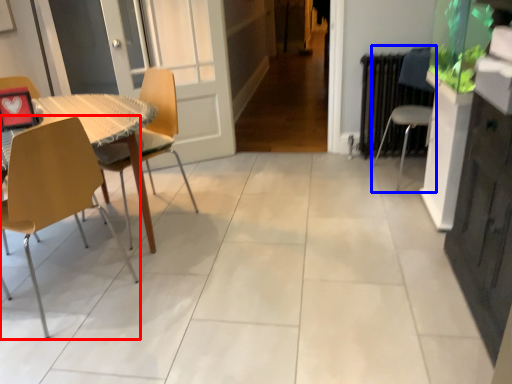
Question: Which point is further to the camera, chair (highlighted by a red box) or chair (highlighted by a blue box)?

Choices:
 (A) chair
 (B) chair

Answer: (B)